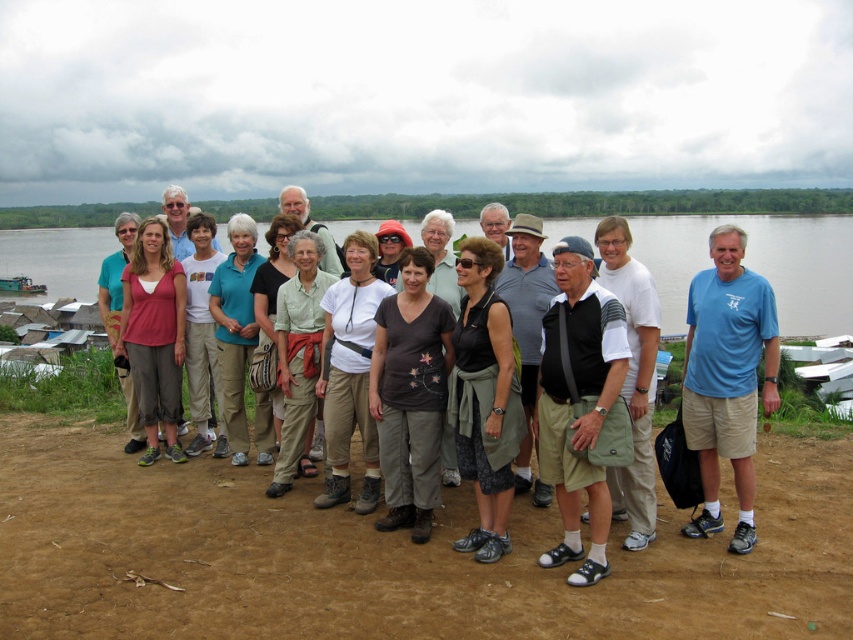
Which is below, brown dirt field at lower center or clear water at center?

brown dirt field at lower center

Does point (142, 566) lie behind point (844, 289)?

No.

Who is more distant from viewer, (550, 544) or (86, 259)?

The point (86, 259) is behind.

Locate an element on the screen. brown dirt field at lower center is located at coordinates (387, 556).

Does dark gray fabric dress at center have a greater width compared to white cotton shirt at center?

No, dark gray fabric dress at center is not wider than white cotton shirt at center.

Which is in front, point (465, 320) or point (347, 333)?

Point (465, 320) is in front.

Which is in front, point (502, 461) or point (328, 305)?

Positioned in front is point (502, 461).

The height and width of the screenshot is (640, 853). I want to click on dark gray fabric dress at center, so click(485, 397).

Between clear water at center and blue t-shirt at center, which one has less height?

With less height is blue t-shirt at center.

This screenshot has height=640, width=853. What do you see at coordinates (757, 264) in the screenshot?
I see `clear water at center` at bounding box center [757, 264].

What do you see at coordinates (757, 264) in the screenshot?
I see `clear water at center` at bounding box center [757, 264].

The image size is (853, 640). Find the location of `clear water at center`. clear water at center is located at coordinates (757, 264).